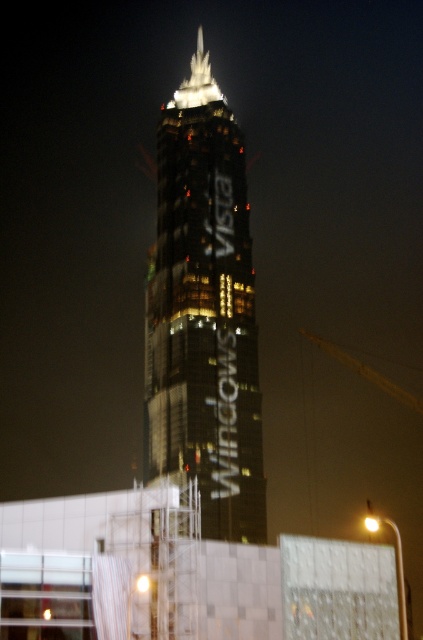
You are standing at the base of the skyscraper and want to take a photo of the building without any obstructions. Given that the transparent plastic scaffolding at lower center is located at point 0.898, 0.428, which is closer to the top or bottom of the building? Please answer based on the coordinates provided.

The transparent plastic scaffolding at lower center is located at point 0.428 on the y coordinate, which is closer to the bottom of the building since lower y values are closer to the bottom.

You are a delivery drone carrying a package that requires a 100 feet clearance to land safely. You are currently above the transparent plastic scaffolding at lower center and need to reach the reflective glass tower at center. Can you safely land your drone between them without hitting any obstacles?

The distance between the transparent plastic scaffolding at lower center and the reflective glass tower at center is 75.30 feet, which is less than the required 100 feet clearance. Therefore, the drone cannot safely land between them without risking collision.

You are standing in front of the skyscraper and want to take a photo. You notice two points marked on the building. Which point is closer to you, point (115,618) or point (348,356)?

Point (115,618) is closer to you than point (348,356).